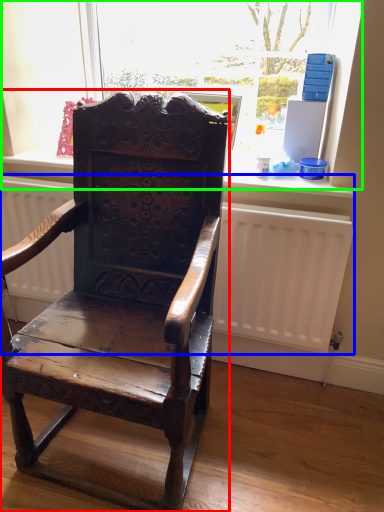
Question: Which object is the farthest from chair (highlighted by a red box)? Choose among these: radiator (highlighted by a blue box) or bay window (highlighted by a green box).

Choices:
 (A) radiator
 (B) bay window

Answer: (B)